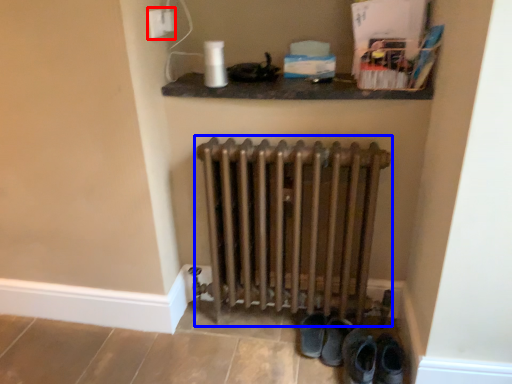
Question: Among these objects, which one is farthest to the camera, electric outlet (highlighted by a red box) or radiator (highlighted by a blue box)?

Choices:
 (A) electric outlet
 (B) radiator

Answer: (A)